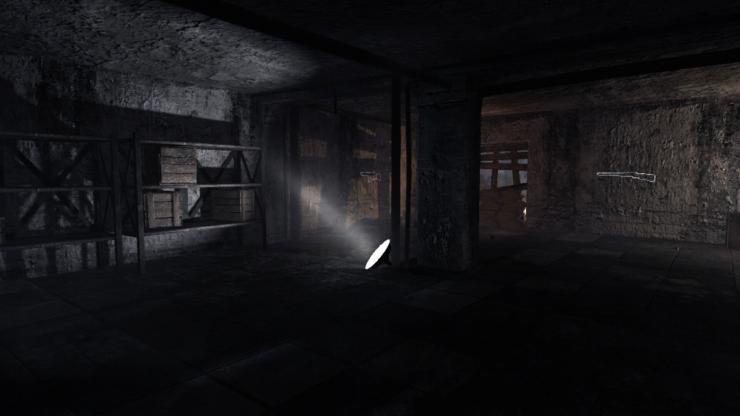
Where is `ceiling`? The width and height of the screenshot is (740, 416). ceiling is located at coordinates (201, 65).